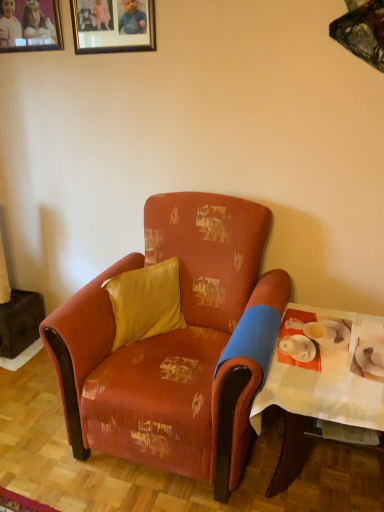
Question: In the image, is satin yellow pillow at center on the left side or the right side of distressed fabric armchair at center?

Choices:
 (A) right
 (B) left

Answer: (B)

Question: Does point pos(120,303) appear closer or farther from the camera than point pos(253,379)?

Choices:
 (A) farther
 (B) closer

Answer: (A)

Question: Based on their relative distances, which object is nearer to the white paper table at right?

Choices:
 (A) distressed fabric armchair at center
 (B) gold-framed picture at upper center, marked as the 1th picture frame in a right-to-left arrangement
 (C) satin yellow pillow at center
 (D) matte wooden picture frame at upper left, the 1th picture frame when ordered from left to right

Answer: (A)

Question: Which object is positioned closest to the distressed fabric armchair at center?

Choices:
 (A) gold-framed picture at upper center, placed as the 2th picture frame when sorted from left to right
 (B) matte wooden picture frame at upper left, the 1th picture frame when ordered from left to right
 (C) satin yellow pillow at center
 (D) white paper table at right

Answer: (C)